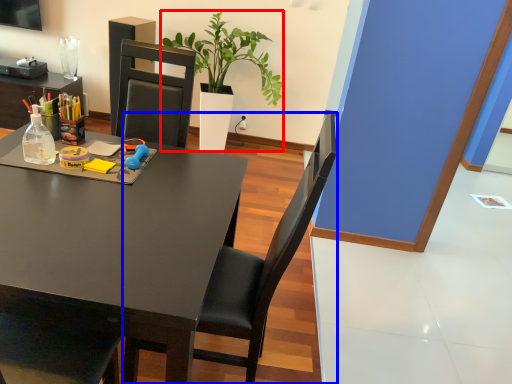
Question: Which point is closer to the camera, houseplant (highlighted by a red box) or chair (highlighted by a blue box)?

Choices:
 (A) houseplant
 (B) chair

Answer: (B)